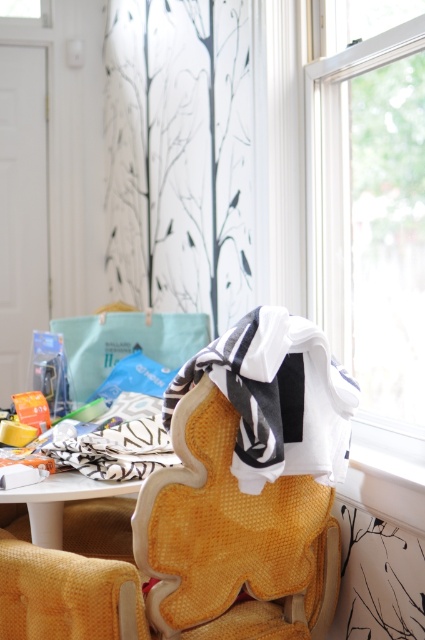
From the picture: Can you confirm if woven fabric armchair at lower left is wider than white glossy table at center?

Indeed, woven fabric armchair at lower left has a greater width compared to white glossy table at center.

This screenshot has width=425, height=640. In order to click on woven fabric armchair at lower left in this screenshot , I will do coord(181,552).

Who is more forward, (x=200, y=636) or (x=266, y=353)?

Point (x=266, y=353) is in front.

Between woven fabric armchair at lower left and white cotton blanket at center, which one appears on the left side from the viewer's perspective?

From the viewer's perspective, woven fabric armchair at lower left appears more on the left side.

I want to click on woven fabric armchair at lower left, so click(x=181, y=552).

Who is positioned more to the left, transparent glass window at upper right or white glossy table at center?

white glossy table at center

Does transparent glass window at upper right appear on the right side of white glossy table at center?

Indeed, transparent glass window at upper right is positioned on the right side of white glossy table at center.

Describe the element at coordinates (371, 227) in the screenshot. I see `transparent glass window at upper right` at that location.

In order to click on transparent glass window at upper right in this screenshot , I will do `click(371, 227)`.